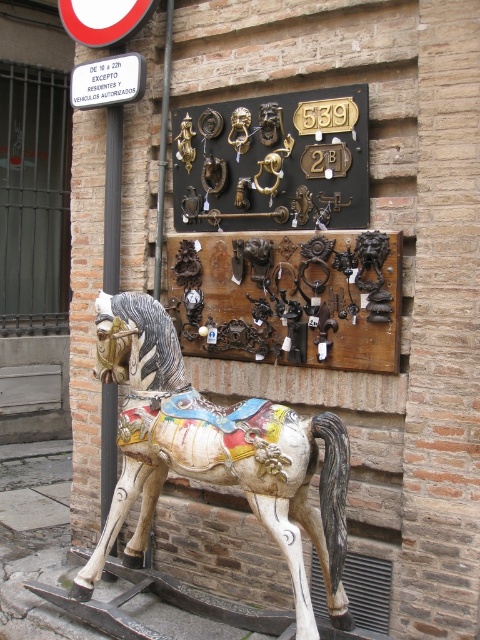
Question: Which of the following is the closest to the observer?

Choices:
 (A) (299, 577)
 (B) (314, 337)
 (C) (119, 179)
 (D) (122, 61)

Answer: (A)

Question: Is black metal pole at left further to the viewer compared to white plastic sign at upper left?

Choices:
 (A) yes
 (B) no

Answer: (A)

Question: Which of these objects is positioned closest to the painted wood horse at center?

Choices:
 (A) black metal pole at left
 (B) white plastic sign at upper left
 (C) gold-bronze door knockers at center
 (D) brown wooden door handles at center

Answer: (D)

Question: Can you confirm if painted wood horse at center is positioned above brown wooden door handles at center?

Choices:
 (A) yes
 (B) no

Answer: (B)

Question: Which is nearer to the gold-bronze door knockers at center?

Choices:
 (A) black metal pole at left
 (B) white plastic sign at upper left

Answer: (B)

Question: From the image, what is the correct spatial relationship of painted wood horse at center in relation to black metal pole at left?

Choices:
 (A) left
 (B) right

Answer: (B)